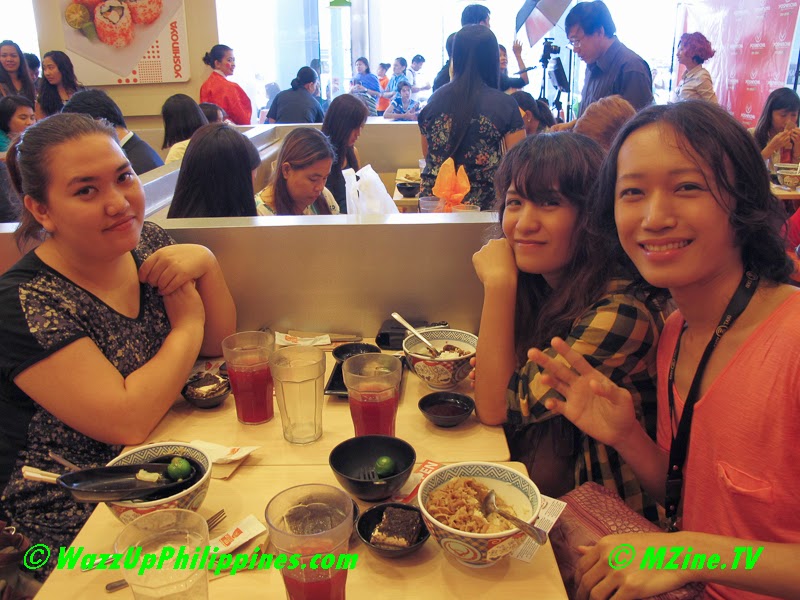
The height and width of the screenshot is (600, 800). In order to click on cups in this screenshot , I will do `click(169, 547)`, `click(322, 536)`, `click(370, 401)`, `click(293, 387)`, `click(250, 368)`, `click(426, 204)`, `click(465, 208)`.